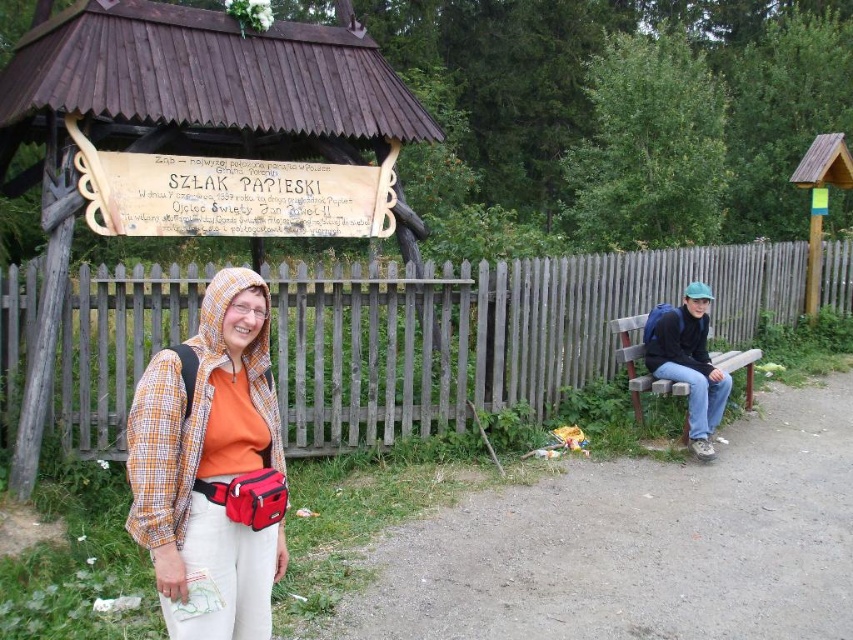
Question: Can you confirm if dirt path at center is positioned above matte orange shirt at center?

Choices:
 (A) no
 (B) yes

Answer: (A)

Question: Which of the following is the farthest from the observer?

Choices:
 (A) (370, 348)
 (B) (637, 403)

Answer: (B)

Question: Can you confirm if dirt path at center is positioned to the right of blue backpack at right?

Choices:
 (A) no
 (B) yes

Answer: (A)

Question: Which point is closer to the camera taking this photo?

Choices:
 (A) (167, 428)
 (B) (334, 316)
 (C) (631, 557)

Answer: (A)

Question: Which point appears farthest from the camera in this image?

Choices:
 (A) (634, 380)
 (B) (267, 460)
 (C) (714, 420)
 (D) (386, 605)

Answer: (A)

Question: Can you confirm if wooden at center is bigger than wooden bench at right?

Choices:
 (A) yes
 (B) no

Answer: (B)